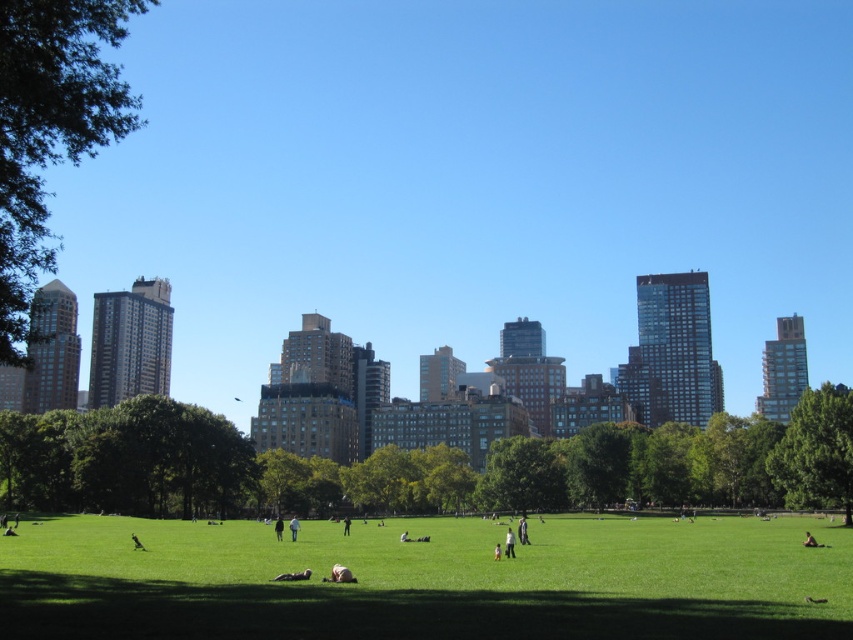
Question: Considering the relative positions of light brown hair at center and dark gray jacket at center in the image provided, where is light brown hair at center located with respect to dark gray jacket at center?

Choices:
 (A) right
 (B) left

Answer: (A)

Question: Which object is positioned farthest from the green leafy tree at lower left?

Choices:
 (A) light gray fabric pants at center
 (B) dark brown leather jacket at center
 (C) dark gray jacket at center
 (D) green leafy tree at center

Answer: (B)

Question: Can you confirm if green leafy tree at upper left is thinner than light brown leather jacket at center?

Choices:
 (A) no
 (B) yes

Answer: (A)

Question: Which object is closer to the camera taking this photo?

Choices:
 (A) green leafy tree at center
 (B) green leafy tree at lower left
 (C) light brown leather jacket at center

Answer: (C)

Question: Which point is farther from the camera taking this photo?

Choices:
 (A) (39, 77)
 (B) (601, 536)

Answer: (B)

Question: Does green leafy tree at center have a greater width compared to light brown leather jacket at center?

Choices:
 (A) yes
 (B) no

Answer: (A)